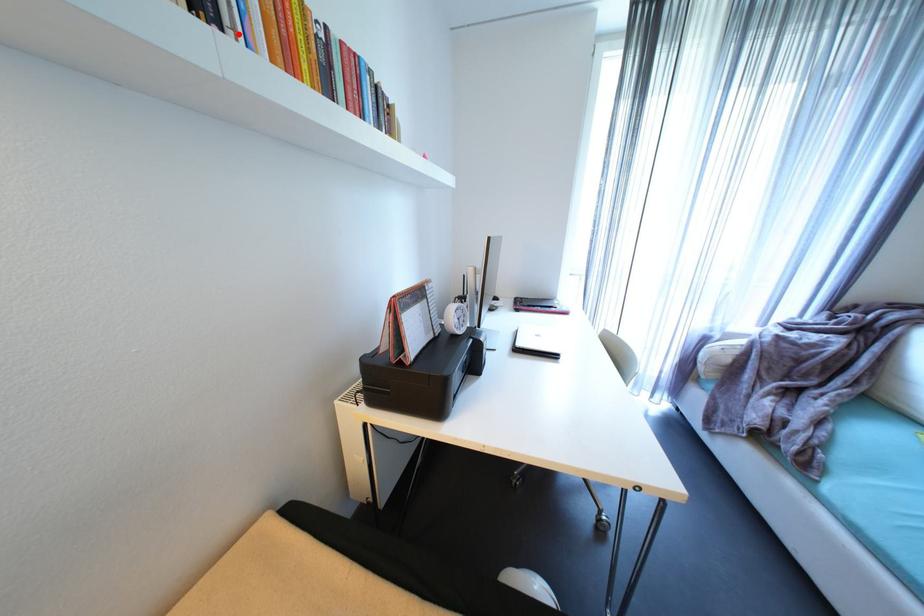
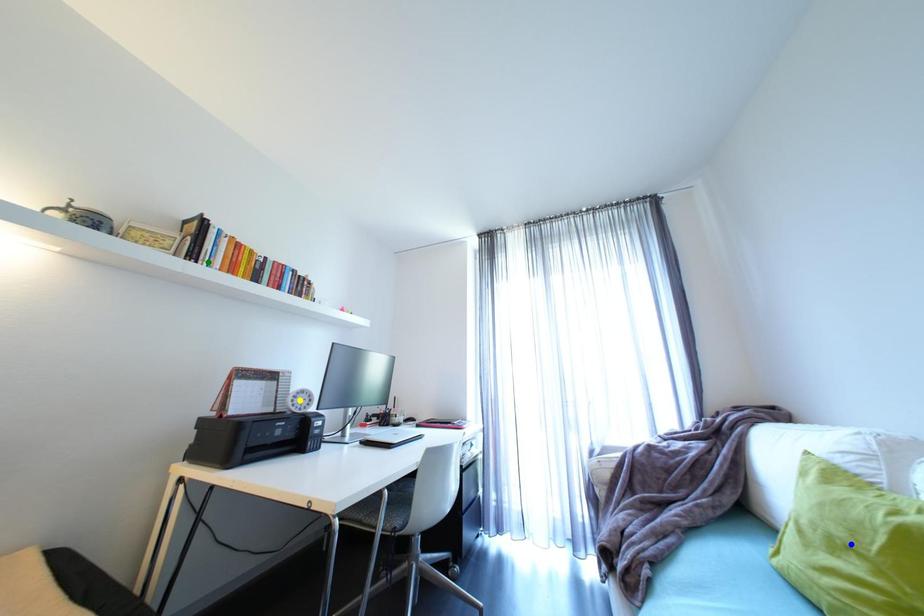
Question: I am providing you with two images of the same scene from different viewpoints. A red point is marked on the first image. You are given multiple points on the second image. Which spot in image 2 lines up with the point in image 1?

Choices:
 (A) blue point
 (B) green point
 (C) yellow point

Answer: (B)